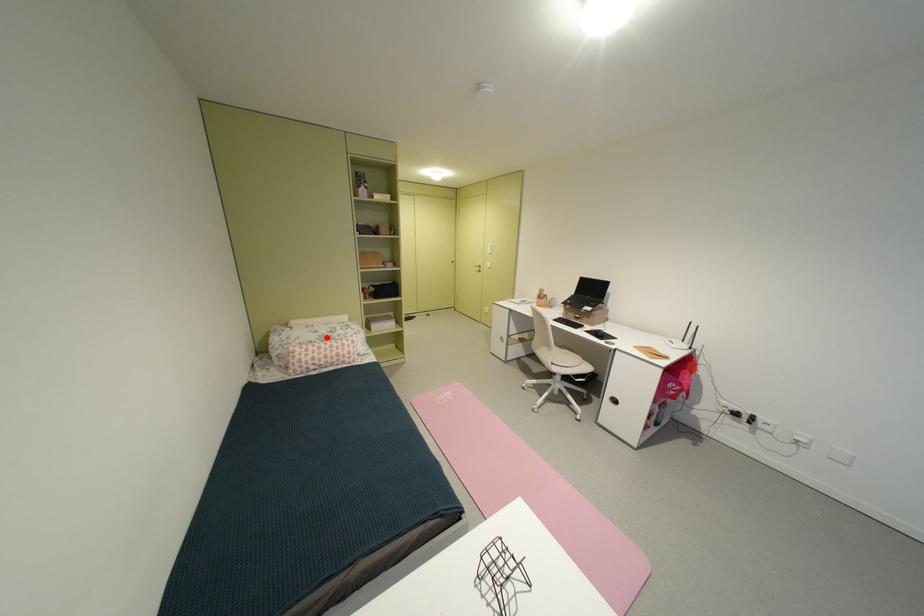
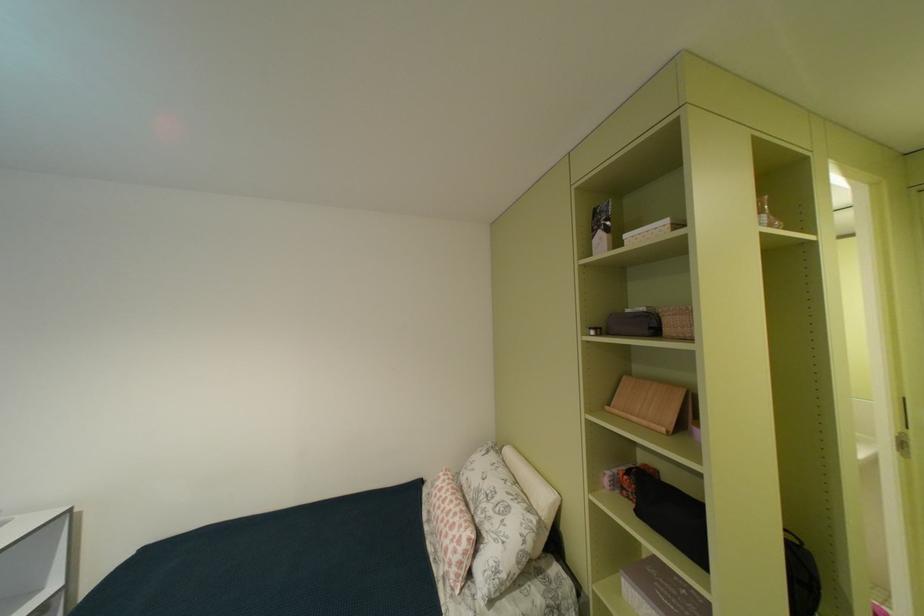
Locate, in the second image, the point that corresponds to the highlighted location in the first image.

(487, 487)